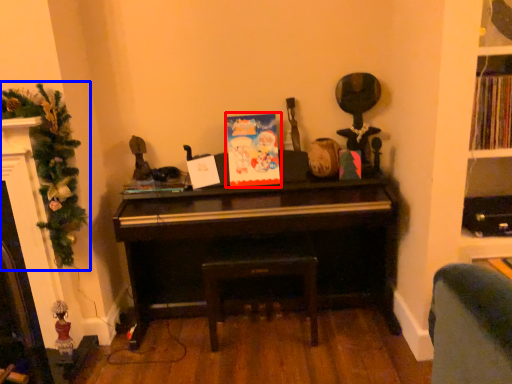
Question: Among these objects, which one is farthest to the camera, christmas card (highlighted by a red box) or christmas tree (highlighted by a blue box)?

Choices:
 (A) christmas card
 (B) christmas tree

Answer: (A)